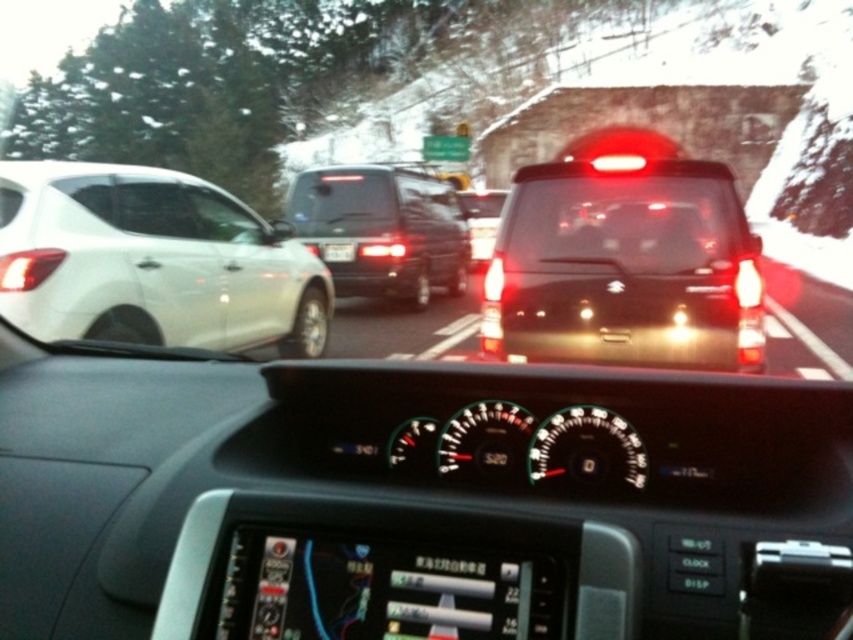
Consider the image. Who is shorter, white glossy hatchback at left or black plastic license plate at center?

black plastic license plate at center is shorter.

How distant is white glossy hatchback at left from black plastic license plate at center?

white glossy hatchback at left and black plastic license plate at center are 3.27 meters apart from each other.

This screenshot has width=853, height=640. Identify the location of white glossy hatchback at left. (151, 260).

Measure the distance between white glossy hatchback at left and matte black suv at center.

white glossy hatchback at left is 32.48 feet from matte black suv at center.

Does white glossy hatchback at left have a greater width compared to matte black suv at center?

No.

Where is `white glossy hatchback at left`? white glossy hatchback at left is located at coordinates (151, 260).

Which is behind, point (693, 218) or point (343, 228)?

Point (343, 228)

Who is positioned more to the left, transparent glass windshield at center or black matte van at center?

From the viewer's perspective, black matte van at center appears more on the left side.

Where is `transparent glass windshield at center`? transparent glass windshield at center is located at coordinates (621, 225).